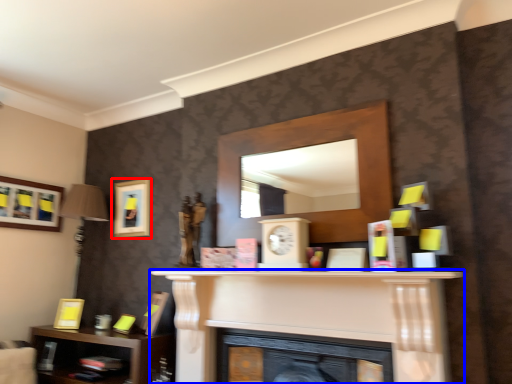
Question: Which object appears farthest to the camera in this image, picture frame (highlighted by a red box) or fireplace (highlighted by a blue box)?

Choices:
 (A) picture frame
 (B) fireplace

Answer: (A)